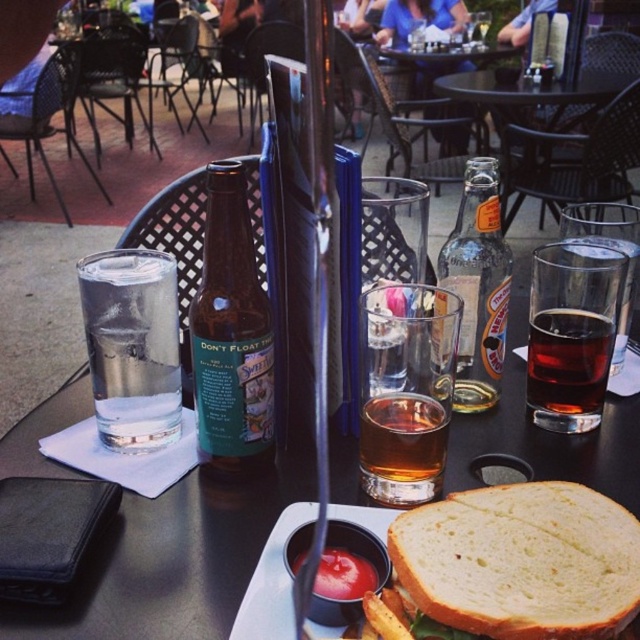
Is point (476, 172) closer to viewer compared to point (531, 369)?

Yes, point (476, 172) is in front of point (531, 369).

Who is taller, clear glass bottle at center-right or dark amber liquid at sandwich right?

clear glass bottle at center-right

Where is `clear glass bottle at center-right`? clear glass bottle at center-right is located at coordinates (477, 285).

Locate an element on the screen. clear glass bottle at center-right is located at coordinates (477, 285).

Looking at this image, does matte glass water at left appear under white bread sandwich at center?

Incorrect, matte glass water at left is not positioned below white bread sandwich at center.

Who is more distant from viewer, (176, 545) or (481, 580)?

Point (176, 545)

What are the coordinates of `matte glass water at left` in the screenshot? It's located at (172, 561).

Who is more distant from viewer, [572,136] or [556,332]?

Point [572,136]

What are the coordinates of `clear glass bottle at center` in the screenshot? It's located at (556, 138).